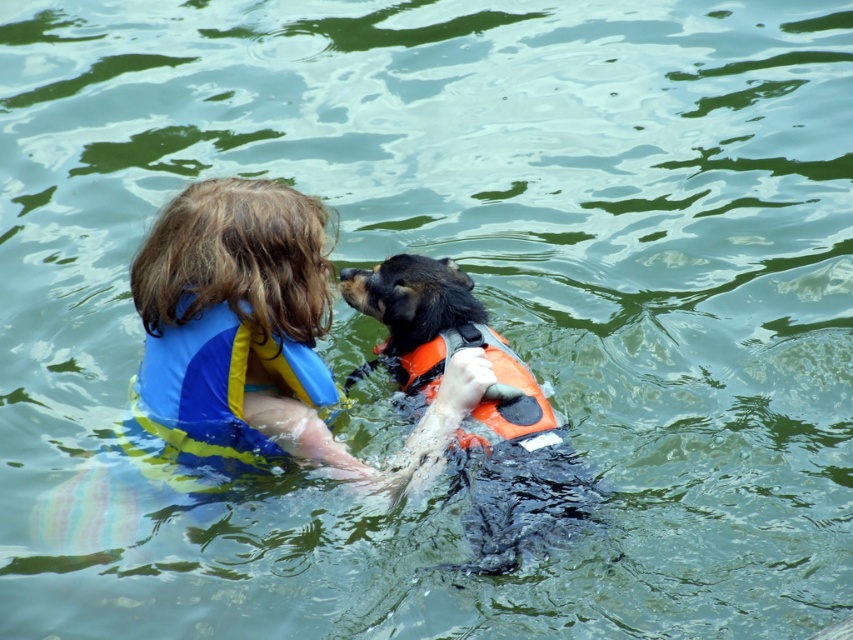
Question: Does blue/yellow fabric life jacket at upper left appear on the right side of orange fabric life jacket at center?

Choices:
 (A) yes
 (B) no

Answer: (B)

Question: Which of the following is the closest to the observer?

Choices:
 (A) blue/yellow fabric life jacket at upper left
 (B) orange fabric life jacket at center
 (C) orange life vest at center

Answer: (C)

Question: Does orange life vest at center appear on the right side of blue/yellow fabric life jacket at upper left?

Choices:
 (A) yes
 (B) no

Answer: (A)

Question: Considering the real-world distances, which object is closest to the orange life vest at center?

Choices:
 (A) blue/yellow fabric life jacket at upper left
 (B) orange fabric life jacket at center

Answer: (B)

Question: Which point is farther to the camera?

Choices:
 (A) orange life vest at center
 (B) blue/yellow fabric life jacket at upper left

Answer: (B)

Question: Is orange life vest at center to the right of orange fabric life jacket at center from the viewer's perspective?

Choices:
 (A) no
 (B) yes

Answer: (A)